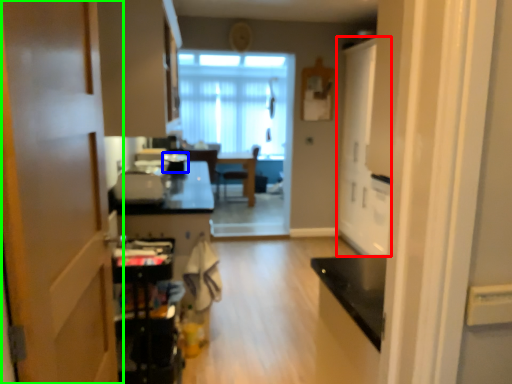
Question: Considering the real-world distances, which object is closest to door (highlighted by a red box)? appliance (highlighted by a blue box) or door (highlighted by a green box).

Choices:
 (A) appliance
 (B) door

Answer: (A)